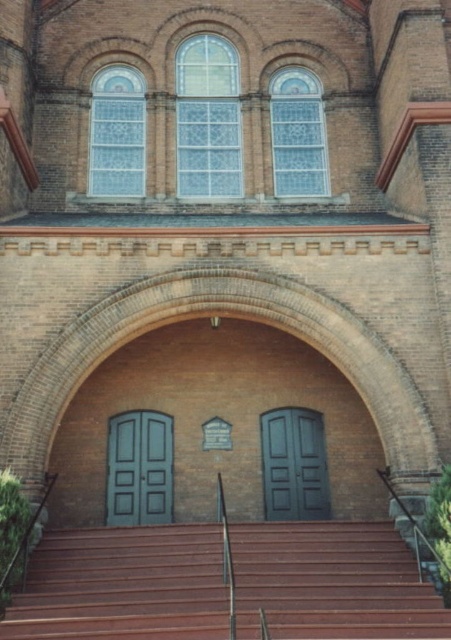
You are standing at the entrance of the brick building and need to reach the teal glossy door at center. Which direction should you move relative to the brown wooden stairs at center to reach it?

The teal glossy door at center is above the brown wooden stairs at center, so you should move upward or climb the brown wooden stairs at center to reach it.

You are a delivery person with a large package that requires two people to carry. You need to enter the building through one of the doors. The teal glossy door at center and the matte black door at center are both in front of you. Considering the distance between them, which door should you approach to ensure you can both fit through without needing to move the package?

The distance between the teal glossy door at center and the matte black door at center is 27.83 feet. Since the two doors are 27.83 feet apart, you and your colleague can approach either door as the distance between them is sufficient to accommodate both of you carrying the package without needing to move it.